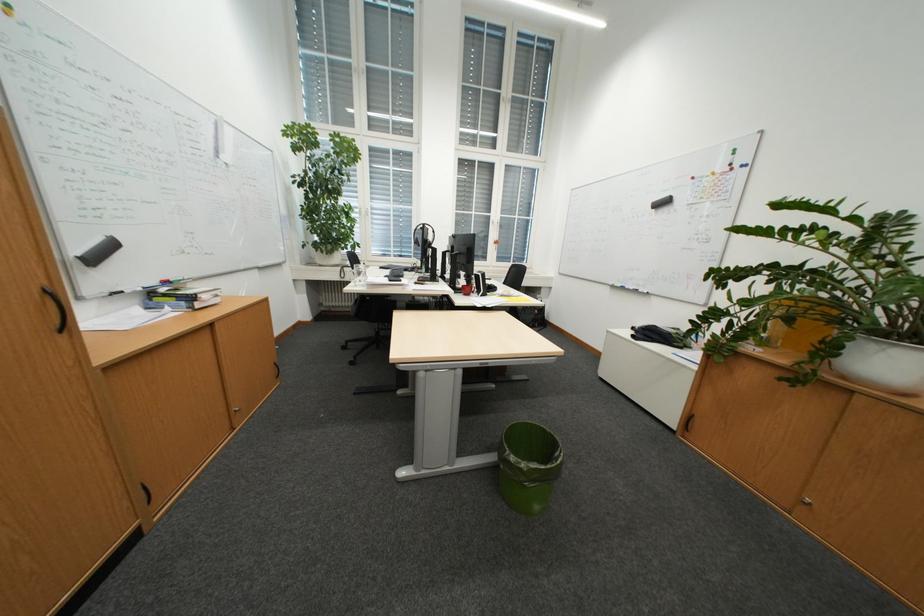
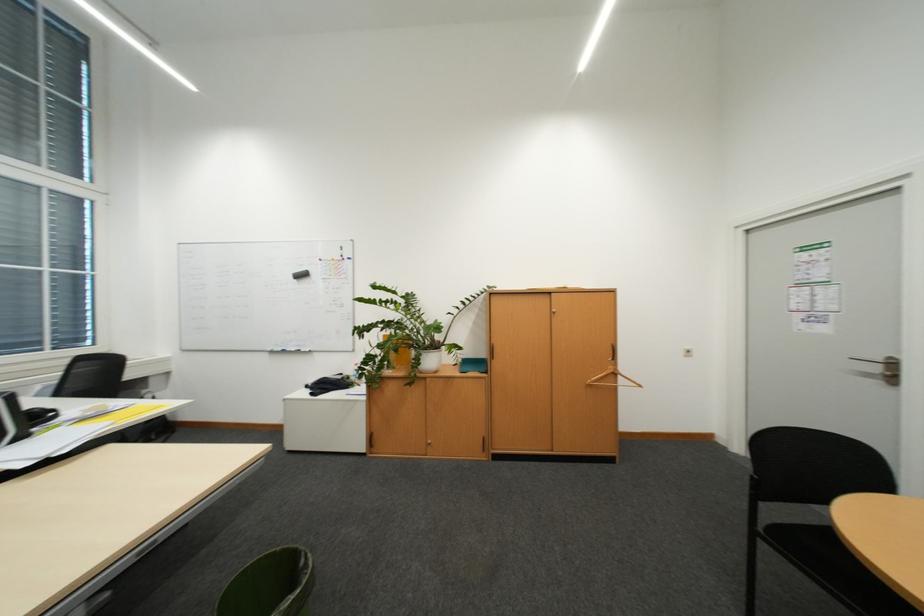
Question: The camera is either moving clockwise (left) or counter-clockwise (right) around the object. The first image is from the beginning of the video and the second image is from the end. Is the camera moving left or right when shooting the video?

Choices:
 (A) Left
 (B) Right

Answer: (A)